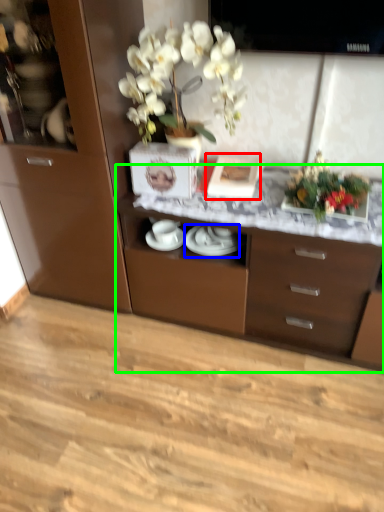
Question: Which object is the closest to the picture frame (highlighted by a red box)? Choose among these: tableware (highlighted by a blue box) or desk (highlighted by a green box).

Choices:
 (A) tableware
 (B) desk

Answer: (A)